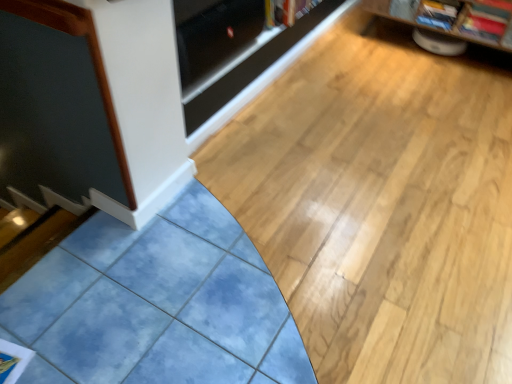
Question: Is wooden bookshelf at upper right inside red glossy magazine at upper right, arranged as the 2th magazine when viewed from the left?

Choices:
 (A) no
 (B) yes

Answer: (A)

Question: Is red glossy magazine at upper right, arranged as the 2th magazine when viewed from the left, further to camera compared to wooden bookshelf at upper right?

Choices:
 (A) yes
 (B) no

Answer: (A)

Question: Considering the relative sizes of red glossy magazine at upper right, acting as the first magazine starting from the right, and wooden bookshelf at upper right in the image provided, is red glossy magazine at upper right, acting as the first magazine starting from the right, wider than wooden bookshelf at upper right?

Choices:
 (A) yes
 (B) no

Answer: (B)

Question: From the image's perspective, would you say red glossy magazine at upper right, acting as the first magazine starting from the right, is positioned over wooden bookshelf at upper right?

Choices:
 (A) no
 (B) yes

Answer: (A)

Question: Is red glossy magazine at upper right, arranged as the 2th magazine when viewed from the left, bigger than wooden bookshelf at upper right?

Choices:
 (A) no
 (B) yes

Answer: (A)

Question: From a real-world perspective, is wooden bookshelf at upper right physically located above or below red glossy magazine at upper right, acting as the first magazine starting from the right?

Choices:
 (A) above
 (B) below

Answer: (B)

Question: Choose the correct answer: Is wooden bookshelf at upper right inside red glossy magazine at upper right, acting as the first magazine starting from the right, or outside it?

Choices:
 (A) inside
 (B) outside

Answer: (B)

Question: From the image's perspective, is wooden bookshelf at upper right located above or below red glossy magazine at upper right, acting as the first magazine starting from the right?

Choices:
 (A) below
 (B) above

Answer: (B)

Question: Looking at their shapes, would you say wooden bookshelf at upper right is wider or thinner than red glossy magazine at upper right, arranged as the 2th magazine when viewed from the left?

Choices:
 (A) thin
 (B) wide

Answer: (B)

Question: Choose the correct answer: Is wooden bookshelf at upper right inside matte plastic magazine at upper right, marked as the second magazine in a right-to-left arrangement, or outside it?

Choices:
 (A) inside
 (B) outside

Answer: (B)

Question: Is wooden bookshelf at upper right wider or thinner than matte plastic magazine at upper right, marked as the second magazine in a right-to-left arrangement?

Choices:
 (A) wide
 (B) thin

Answer: (A)

Question: Is wooden bookshelf at upper right in front of or behind matte plastic magazine at upper right, arranged as the 1th magazine when viewed from the left, in the image?

Choices:
 (A) behind
 (B) front

Answer: (B)

Question: Is point (414, 23) closer or farther from the camera than point (449, 3)?

Choices:
 (A) farther
 (B) closer

Answer: (A)

Question: Is red glossy magazine at upper right, arranged as the 2th magazine when viewed from the left, situated inside hardcover book at upper center or outside?

Choices:
 (A) outside
 (B) inside

Answer: (A)

Question: From the image's perspective, is red glossy magazine at upper right, arranged as the 2th magazine when viewed from the left, positioned above or below hardcover book at upper center?

Choices:
 (A) above
 (B) below

Answer: (B)